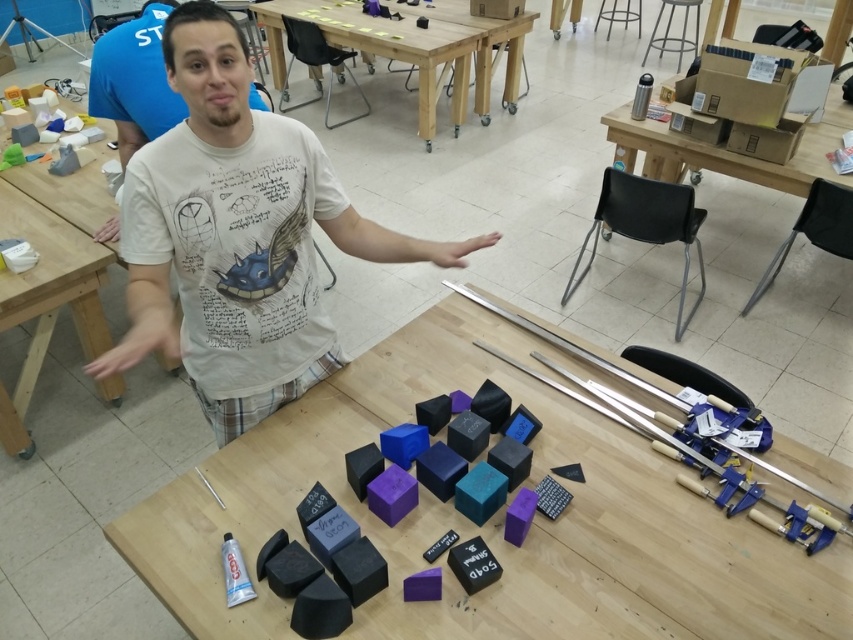
Question: In this image, where is wooden table at left located relative to matte white hand at lower left?

Choices:
 (A) right
 (B) left

Answer: (B)

Question: Which of the following is the farthest from the observer?

Choices:
 (A) white cotton t-shirt at center
 (B) metallic silver thermos at upper right
 (C) skinny flesh at center
 (D) metallic stool at upper right

Answer: (D)

Question: Can you confirm if skinny flesh at center is positioned to the right of matte white hand at lower left?

Choices:
 (A) no
 (B) yes

Answer: (B)

Question: Which of the following is the closest to the observer?

Choices:
 (A) metallic silver thermos at upper right
 (B) matte plastic blocks at center
 (C) white cotton t-shirt at center
 (D) metallic stool at upper right

Answer: (C)

Question: Does matte plastic blocks at center have a greater width compared to metallic silver thermos at upper right?

Choices:
 (A) yes
 (B) no

Answer: (A)

Question: Which point appears farthest from the camera in this image?

Choices:
 (A) (387, 45)
 (B) (488, 236)
 (C) (0, 424)

Answer: (A)